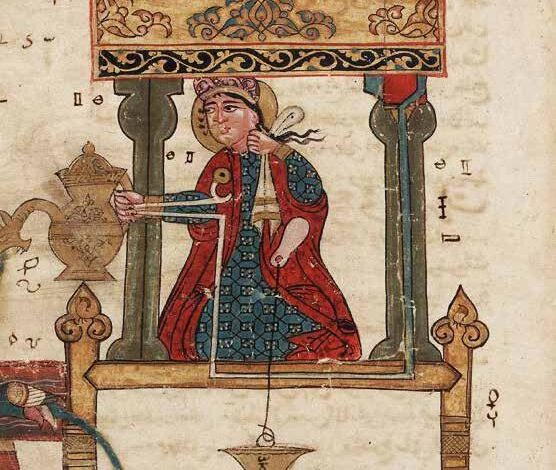
In order to click on ornate tea or coffee pot in this screenshot , I will do `click(77, 220)`.